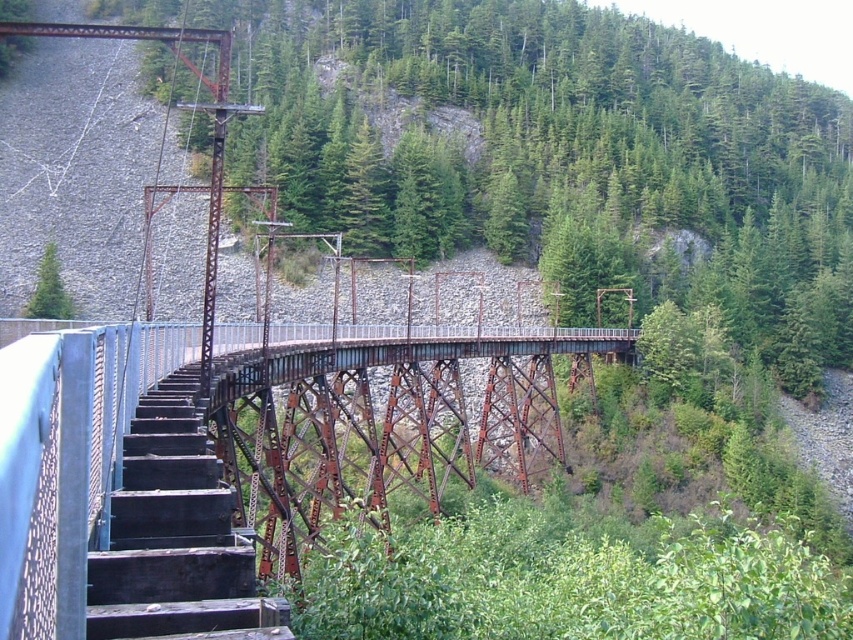
Consider the image. Does rusty metal stairs at center have a greater height compared to green matte tree at upper left?

No, rusty metal stairs at center is not taller than green matte tree at upper left.

Between rusty metal stairs at center and green matte tree at upper left, which one is positioned lower?

Positioned lower is rusty metal stairs at center.

Where is `rusty metal stairs at center`? This screenshot has width=853, height=640. rusty metal stairs at center is located at coordinates (177, 536).

From the picture: Is rusty metal bridge at center shorter than green matte tree at upper left?

No.

Does point (273, 621) come in front of point (38, 282)?

Yes, point (273, 621) is in front of point (38, 282).

Is point (422, 326) farther from viewer compared to point (44, 298)?

No, it is in front of (44, 298).

Image resolution: width=853 pixels, height=640 pixels. Identify the location of rusty metal bridge at center. (233, 458).

Which of these two, rusty metal bridge at center or rusty metal stairs at center, stands shorter?

Standing shorter between the two is rusty metal stairs at center.

Measure the distance between rusty metal bridge at center and rusty metal stairs at center.

rusty metal bridge at center is 16.41 meters away from rusty metal stairs at center.

Does point (373, 481) come behind point (199, 636)?

Yes, it is.

Locate an element on the screen. This screenshot has width=853, height=640. rusty metal bridge at center is located at coordinates (233, 458).